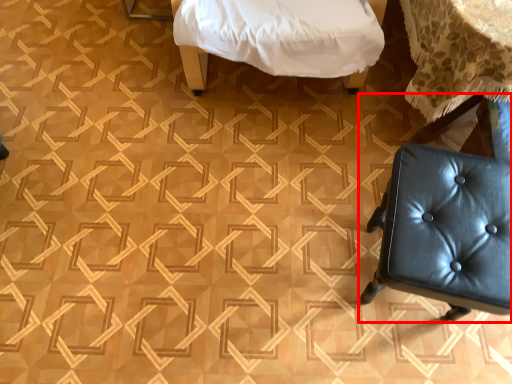
Question: From the image's perspective, what is the correct spatial relationship of chair (annotated by the red box) in relation to furniture?

Choices:
 (A) above
 (B) below

Answer: (B)